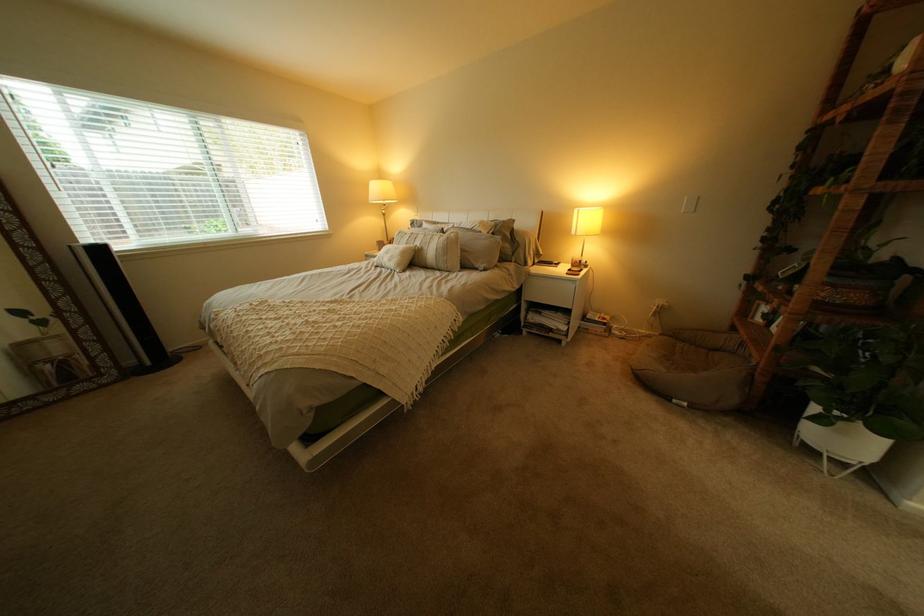
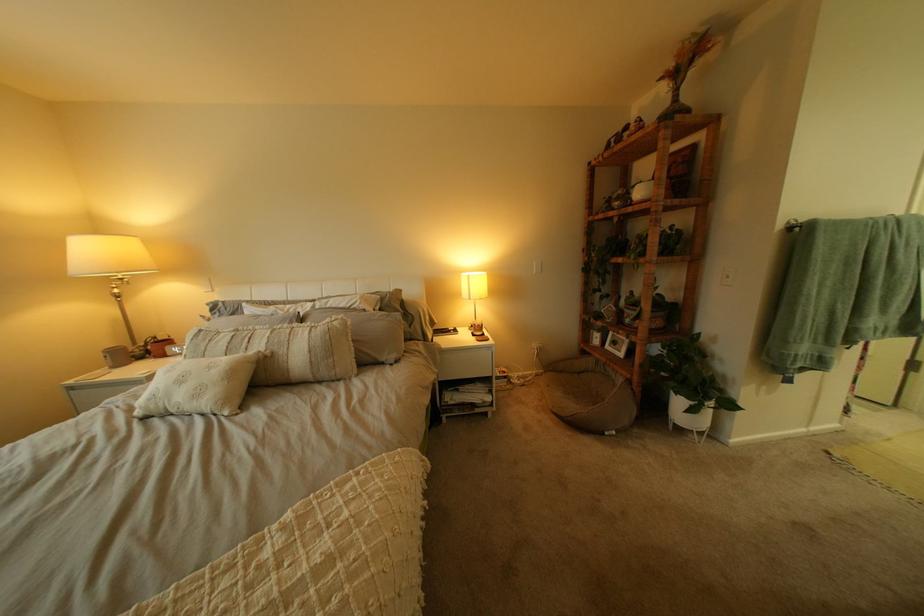
Locate, in the second image, the point that corresponds to [593,212] in the first image.

(483, 277)